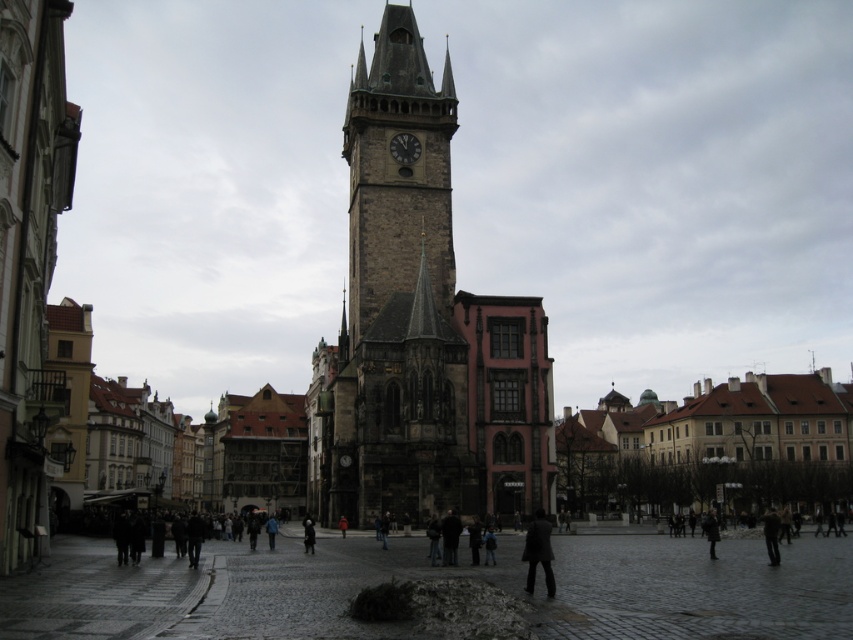
Does dark gray coat at lower right appear under dark gray stone clock at center?

Correct, dark gray coat at lower right is located below dark gray stone clock at center.

Is dark gray coat at lower right taller than dark gray stone clock at center?

Yes.

Locate an element on the screen. dark gray coat at lower right is located at coordinates (538, 552).

Which is more to the right, stone clock tower at center or dark gray coat at lower right?

Positioned to the right is dark gray coat at lower right.

From the picture: Is stone clock tower at center in front of dark gray coat at lower right?

No, stone clock tower at center is behind dark gray coat at lower right.

What do you see at coordinates (397, 173) in the screenshot?
I see `stone clock tower at center` at bounding box center [397, 173].

Locate an element on the screen. stone clock tower at center is located at coordinates (397, 173).

Does point (399, 24) lie behind point (408, 156)?

That is True.

What do you see at coordinates (397, 173) in the screenshot? The image size is (853, 640). I see `stone clock tower at center` at bounding box center [397, 173].

Does point (358, 52) come behind point (393, 144)?

Yes, it is behind point (393, 144).

The height and width of the screenshot is (640, 853). Identify the location of stone clock tower at center. (397, 173).